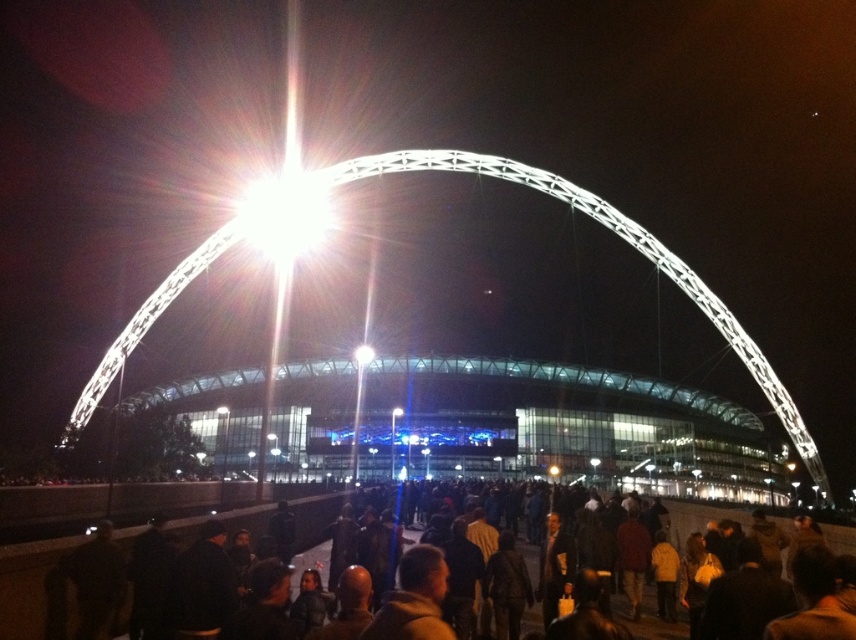
Question: Does dark brown clothing at lower center have a larger size compared to bright white light at center?

Choices:
 (A) no
 (B) yes

Answer: (B)

Question: Among these points, which one is nearest to the camera?

Choices:
 (A) (290, 500)
 (B) (247, 236)

Answer: (A)

Question: Does dark brown clothing at lower center have a larger size compared to bright white light at center?

Choices:
 (A) yes
 (B) no

Answer: (A)

Question: Is dark brown clothing at lower center thinner than bright white light at center?

Choices:
 (A) no
 (B) yes

Answer: (A)